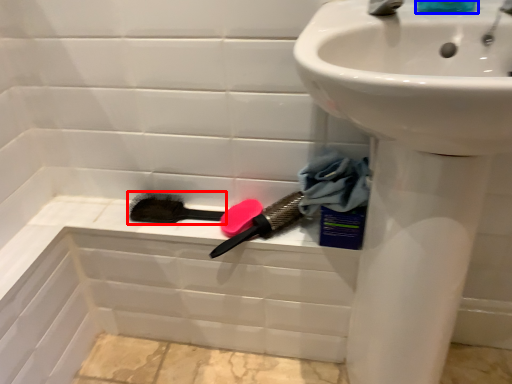
Question: Which of the following is the farthest to the observer, brush (highlighted by a red box) or liquid (highlighted by a blue box)?

Choices:
 (A) brush
 (B) liquid

Answer: (A)